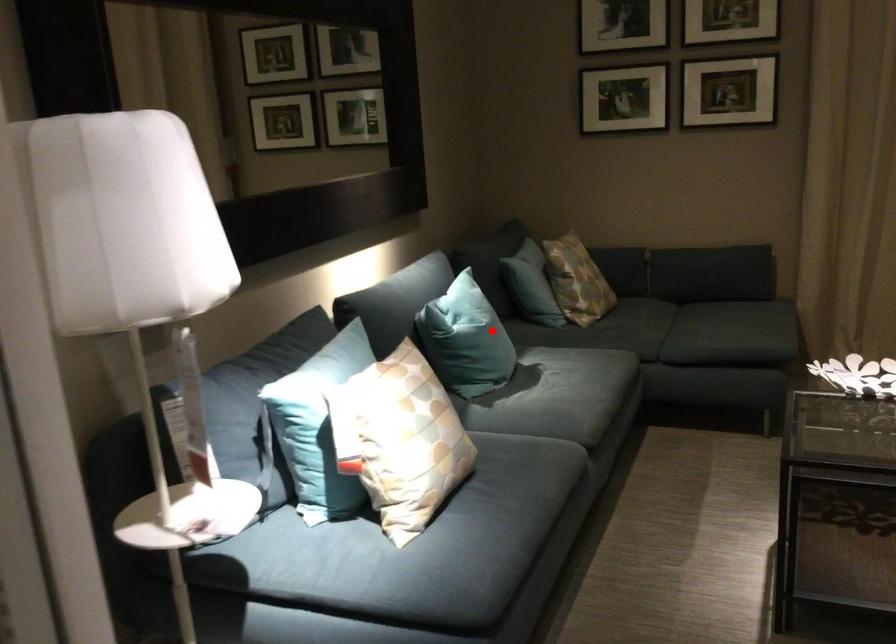
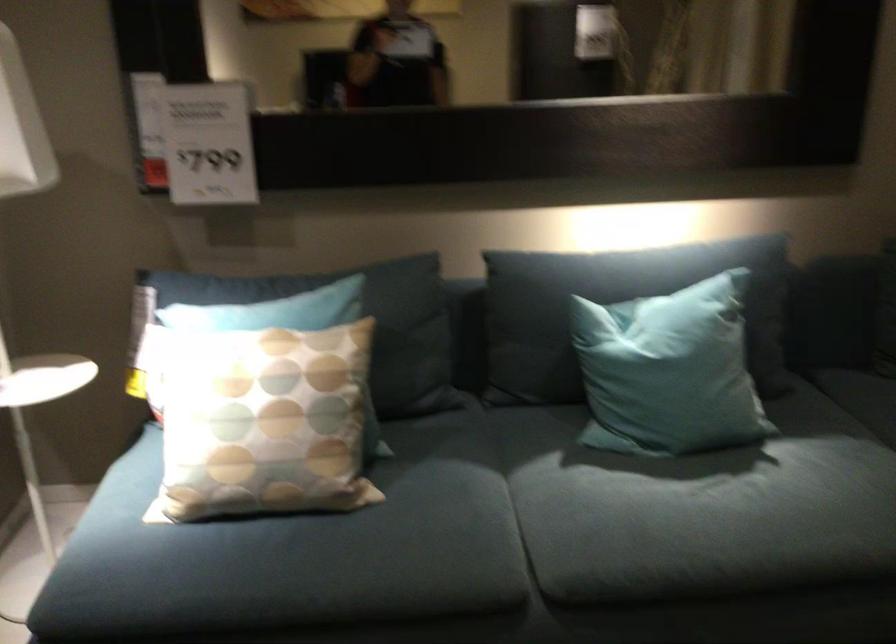
Locate, in the second image, the point that corresponds to the highlighted location in the first image.

(668, 371)